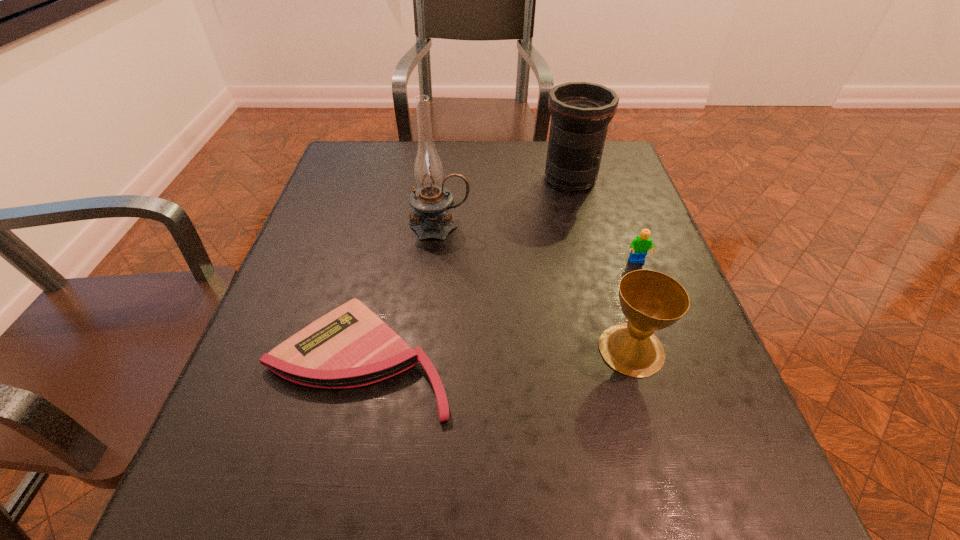
The image size is (960, 540). I want to click on vacant area located on the left of the third tallest object, so click(x=420, y=349).

I want to click on free spot located 0.260m on the face of the Lego, so point(678,373).

Find the location of a particular element. free space located on the back of the shortest object is located at coordinates (378, 278).

This screenshot has height=540, width=960. I want to click on object that is at the far edge, so click(x=580, y=112).

Identify the location of object that is at the left edge. (350, 346).

Where is `telephoto lens positioned at the right edge`? telephoto lens positioned at the right edge is located at coordinates (580, 112).

Image resolution: width=960 pixels, height=540 pixels. What are the coordinates of `chalice present at the right edge` in the screenshot? It's located at (650, 300).

Where is `Lego located in the right edge section of the desktop`? This screenshot has width=960, height=540. Lego located in the right edge section of the desktop is located at coordinates click(x=641, y=244).

The width and height of the screenshot is (960, 540). In order to click on object located in the far right corner section of the desktop in this screenshot , I will do `click(580, 112)`.

You are a GUI agent. You are given a task and a screenshot of the screen. Output one action in this format:
    pyautogui.click(x=<x>, y=<y>)
    Task: Click on the blank area at the far edge
    The width and height of the screenshot is (960, 540).
    Given the screenshot: What is the action you would take?
    pyautogui.click(x=461, y=144)